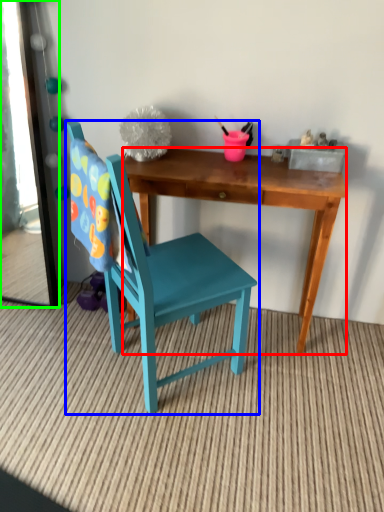
Question: Which object is the farthest from desk (highlighted by a red box)? Choose among these: chair (highlighted by a blue box) or mirror (highlighted by a green box).

Choices:
 (A) chair
 (B) mirror

Answer: (B)